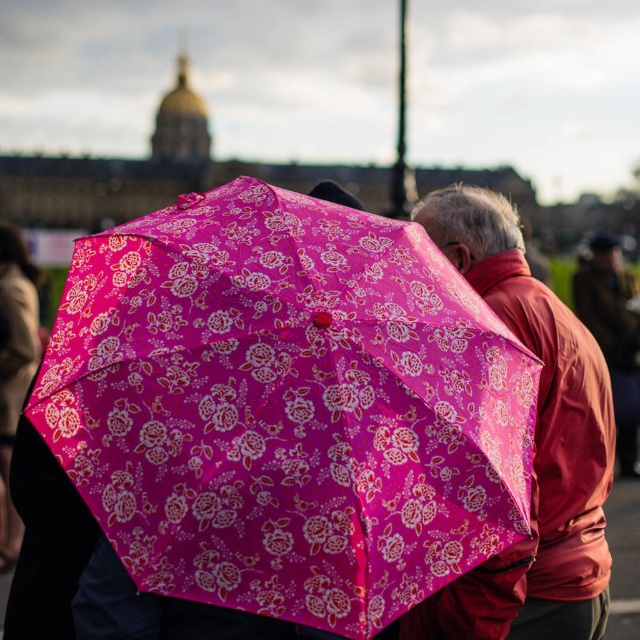
You are a photographer trying to focus on two specific points in the scene. The first point is at coordinate point (102,424) and the second is at point (10,356). Which point is closer to your camera lens?

Point (102,424) is closer to the camera lens than point (10,356).

You are a photographer trying to capture the pink umbrella at center in your shot. The camera you are using has a focus point at coordinate point (534, 445). Based on the scene, will the focus point be on the pink umbrella at center?

Yes, the focus point at coordinate point (534, 445) is on the matte pink umbrella at center as described.

You are a photographer trying to capture the pink fabric umbrella at center and the pink floral umbrella at upper left. Since both are in the frame, can you tell which one is closer to the camera based on their positions?

The pink fabric umbrella at center is closer to the camera than the pink floral umbrella at upper left because it is in front of it.